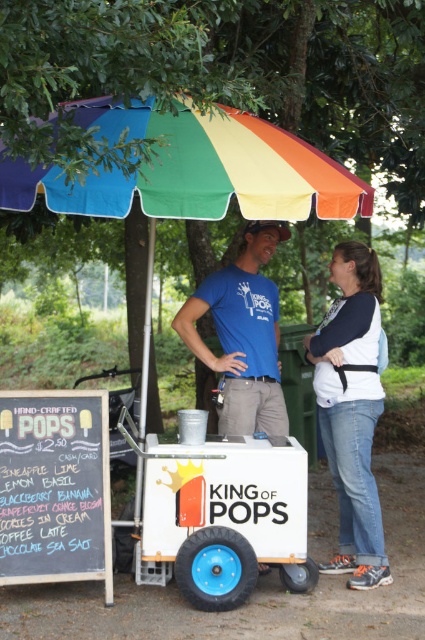
Question: Which object appears farthest from the camera in this image?

Choices:
 (A) blue jeans at lower right
 (B) blue t-shirt at center
 (C) white matte ice cream cart at center

Answer: (B)

Question: Does rainbow fabric umbrella at upper center have a larger size compared to white matte ice cream cart at center?

Choices:
 (A) no
 (B) yes

Answer: (B)

Question: Which object is positioned farthest from the blue t-shirt at center?

Choices:
 (A) white plastic cart at center
 (B) black chalkboard at lower left

Answer: (B)

Question: Does white plastic cart at center appear on the right side of rainbow fabric umbrella at upper center?

Choices:
 (A) yes
 (B) no

Answer: (A)

Question: Does blue jeans at lower right lie behind blue t-shirt at center?

Choices:
 (A) yes
 (B) no

Answer: (B)

Question: Considering the real-world distances, which object is farthest from the blue t-shirt at center?

Choices:
 (A) white plastic cart at center
 (B) black chalkboard at lower left
 (C) white matte ice cream cart at center
 (D) blue jeans at lower right

Answer: (B)